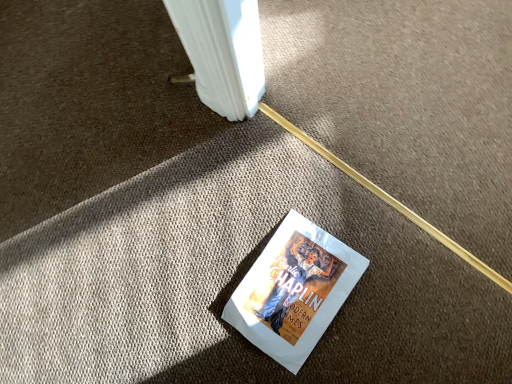
Find the location of `free space above white paper at center (from a real-world perspective)`. free space above white paper at center (from a real-world perspective) is located at coordinates (298, 289).